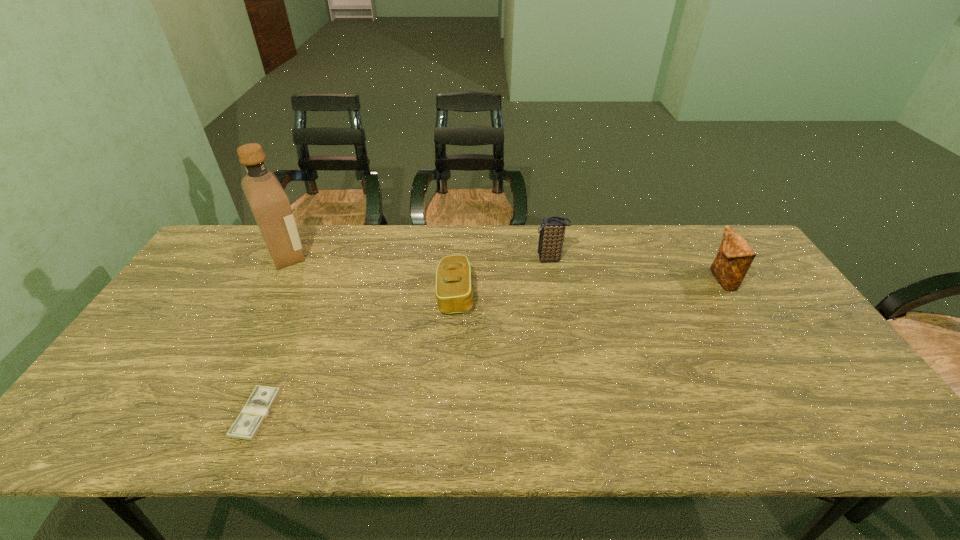
Find the location of a particular element. The width and height of the screenshot is (960, 540). object that is at the right edge is located at coordinates (735, 256).

Where is `object at the far right corner`? This screenshot has height=540, width=960. object at the far right corner is located at coordinates (735, 256).

The width and height of the screenshot is (960, 540). I want to click on free space at the far edge of the desktop, so click(365, 242).

In the image, there is a desktop. Identify the location of vacant space at the near edge. (472, 429).

In order to click on vacant space at the right edge of the desktop in this screenshot , I will do `click(777, 290)`.

At what (x,y) coordinates should I click in order to perform the action: click on vacant space at the near left corner. Please return your answer as a coordinate pair (x, y). The image size is (960, 540). Looking at the image, I should click on (65, 442).

Where is `blank space at the near right corner of the desktop`? blank space at the near right corner of the desktop is located at coordinates (844, 428).

Find the location of `blank region between the rightmost clutch bag and the tallest object`. blank region between the rightmost clutch bag and the tallest object is located at coordinates (504, 267).

Where is `free space between the liquor and the fourth object from left to right`? Image resolution: width=960 pixels, height=540 pixels. free space between the liquor and the fourth object from left to right is located at coordinates (419, 256).

Locate an element on the screen. vacant area between the rightmost clutch bag and the shortest clutch bag is located at coordinates (588, 288).